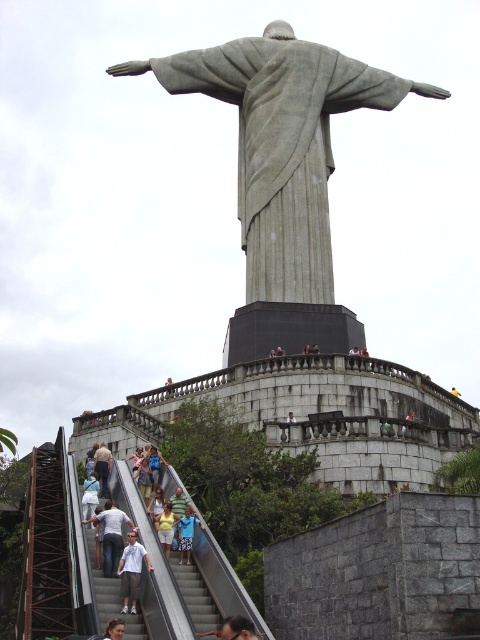
Question: Which is farther from the white cotton shirt at lower center?

Choices:
 (A) light gray jeans at lower center
 (B) gray stone statue at upper center
 (C) white fabric shirt at lower center

Answer: (B)

Question: Does yellow fabric shirt at lower center have a smaller size compared to light blue shirt at center?

Choices:
 (A) no
 (B) yes

Answer: (A)

Question: Which object is closer to the camera taking this photo?

Choices:
 (A) light blue shirt at center
 (B) gray stone statue at upper center
 (C) light gray stone statue at center
 (D) gray concrete stairs at lower center

Answer: (D)

Question: Does light gray jeans at lower center have a greater width compared to blue shirt at center?

Choices:
 (A) no
 (B) yes

Answer: (B)

Question: Does white fabric shirt at lower center come in front of light blue shirt at center?

Choices:
 (A) yes
 (B) no

Answer: (A)

Question: Which point is closer to the camera taking this photo?

Choices:
 (A) (137, 548)
 (B) (109, 516)

Answer: (A)